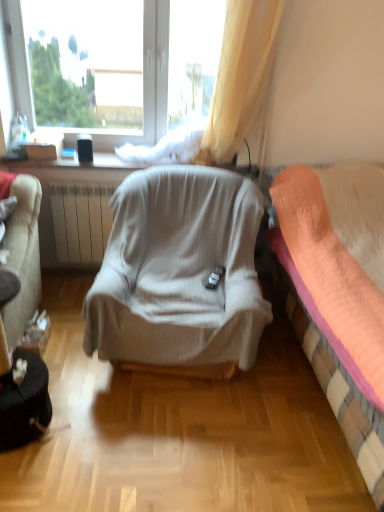
Question: Considering the relative sizes of light gray fabric chair at center and transparent plastic window at upper center in the image provided, is light gray fabric chair at center smaller than transparent plastic window at upper center?

Choices:
 (A) yes
 (B) no

Answer: (B)

Question: Does light gray fabric chair at center have a greater width compared to transparent plastic window at upper center?

Choices:
 (A) yes
 (B) no

Answer: (A)

Question: Is light gray fabric chair at center far away from transparent plastic window at upper center?

Choices:
 (A) no
 (B) yes

Answer: (B)

Question: From the image's perspective, is light gray fabric chair at center below transparent plastic window at upper center?

Choices:
 (A) no
 (B) yes

Answer: (B)

Question: Is light gray fabric chair at center to the left of transparent plastic window at upper center from the viewer's perspective?

Choices:
 (A) yes
 (B) no

Answer: (B)

Question: From the image's perspective, is light gray fabric chair at center on transparent plastic window at upper center?

Choices:
 (A) yes
 (B) no

Answer: (B)

Question: Is orange fabric bed at right facing towards light gray fabric chair at center?

Choices:
 (A) no
 (B) yes

Answer: (B)

Question: Would you consider orange fabric bed at right to be distant from light gray fabric chair at center?

Choices:
 (A) yes
 (B) no

Answer: (B)

Question: Can we say orange fabric bed at right lies outside light gray fabric chair at center?

Choices:
 (A) no
 (B) yes

Answer: (B)

Question: Is orange fabric bed at right shorter than light gray fabric chair at center?

Choices:
 (A) yes
 (B) no

Answer: (B)

Question: Does orange fabric bed at right contain light gray fabric chair at center?

Choices:
 (A) no
 (B) yes

Answer: (A)

Question: Is orange fabric bed at right behind light gray fabric chair at center?

Choices:
 (A) yes
 (B) no

Answer: (B)

Question: Is transparent plastic window at upper center shorter than light gray fabric chair at center?

Choices:
 (A) no
 (B) yes

Answer: (A)